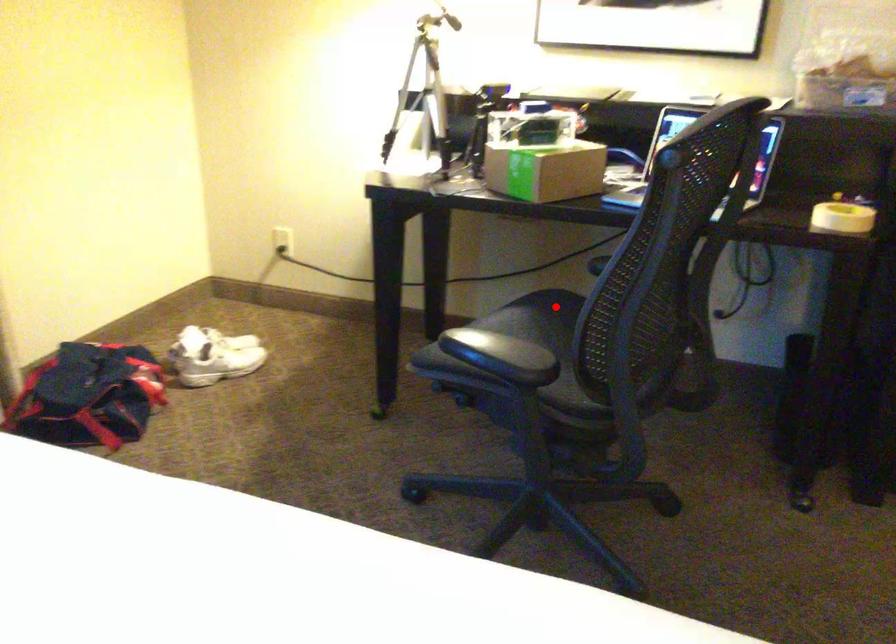
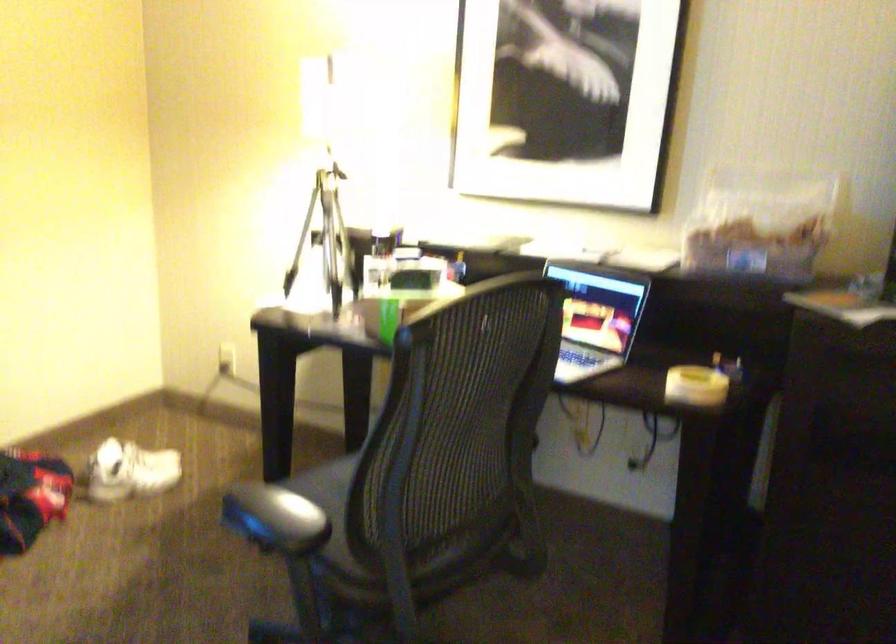
Question: I am providing you with two images of the same scene from different viewpoints. A red point is marked on the first image. Can you still see the location of the red point in image 2?

Choices:
 (A) Yes
 (B) No

Answer: (B)